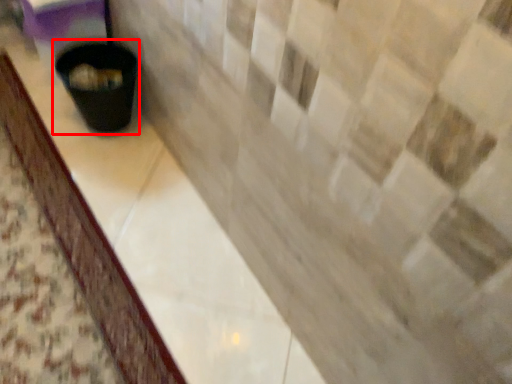
Question: Considering the relative positions of waste container (annotated by the red box) and counter top in the image provided, where is waste container (annotated by the red box) located with respect to the staircase?

Choices:
 (A) right
 (B) left

Answer: (A)